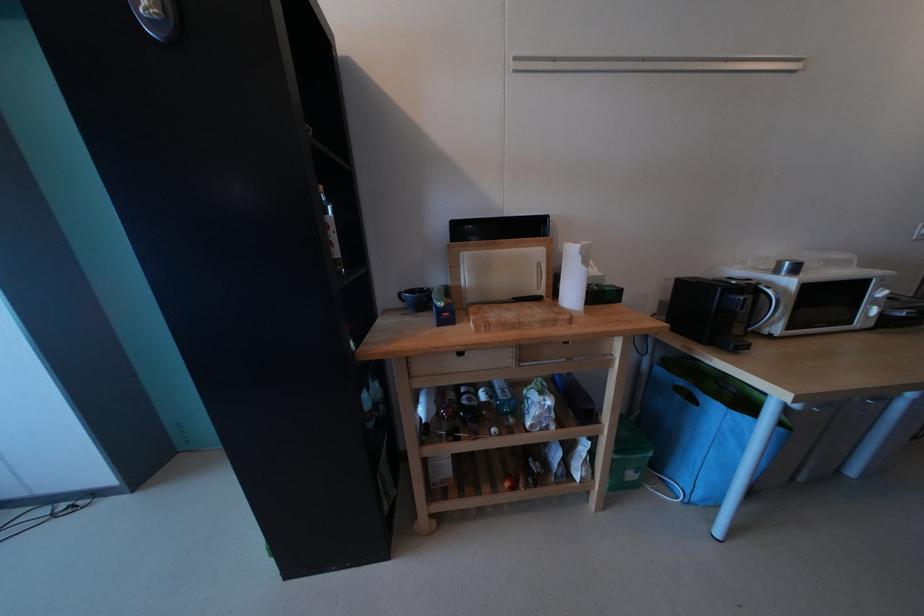
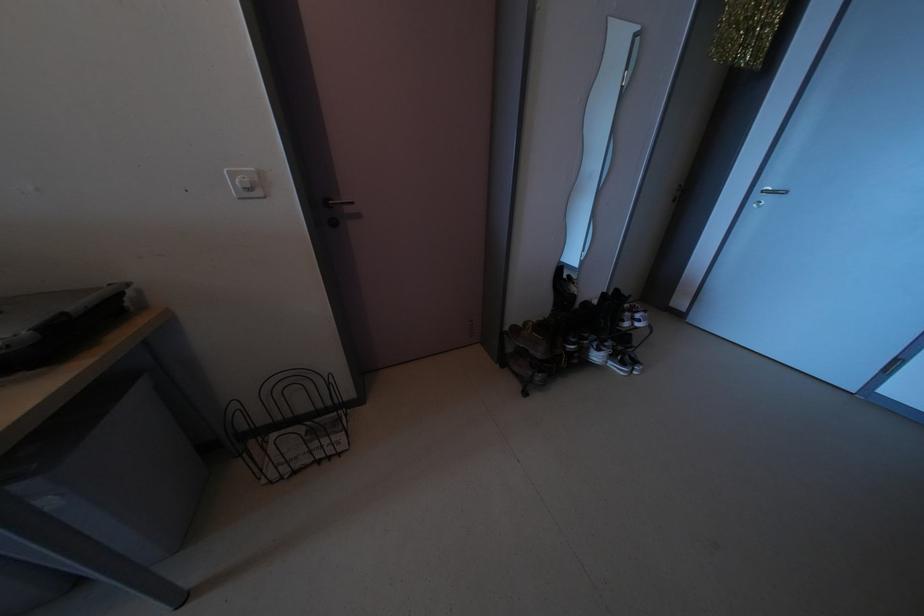
Question: The images are taken continuously from a first-person perspective. In which direction are you moving?

Choices:
 (A) Left
 (B) Right
 (C) Forward
 (D) Backward

Answer: (B)